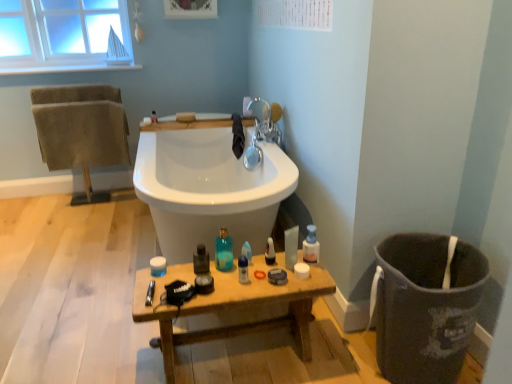
Question: Looking at their shapes, would you say translucent plastic bottle at center, the 2th toiletry from the top, is wider or thinner than translucent blue glass bottle at center, which is counted as the 3th toiletry, starting from the top?

Choices:
 (A) thin
 (B) wide

Answer: (A)

Question: From a real-world perspective, is translucent plastic bottle at center, the 2th toiletry from the top, above or below translucent blue glass bottle at center, the first toiletry from the front?

Choices:
 (A) below
 (B) above

Answer: (A)

Question: Which of these objects is positioned closest to the brown textured towels at left, the 2th bath towel from the right?

Choices:
 (A) translucent plastic soap at upper center, marked as the 4th toiletry in a right-to-left arrangement
 (B) translucent glass mouthwash at center, placed as the second mouthwash when sorted from right to left
 (C) silver metallic faucet at upper center
 (D) translucent plastic spray bottle at center, arranged as the second cleaning product when viewed from the right
 (E) wooden table at lower center

Answer: (A)

Question: Estimate the real-world distances between objects in this image. Which object is farther from the translucent plastic container at center, the second toiletry when ordered from left to right?

Choices:
 (A) black cloth at upper center, which appears as the second bath towel when viewed from the left
 (B) translucent plastic soap at upper center, which ranks as the first toiletry in top-to-bottom order
 (C) wooden table at lower center
 (D) translucent glass mouthwash at center, which is counted as the first mouthwash, starting from the left
 (E) translucent blue glass bottle at center, which is counted as the 3th toiletry, starting from the top

Answer: (A)